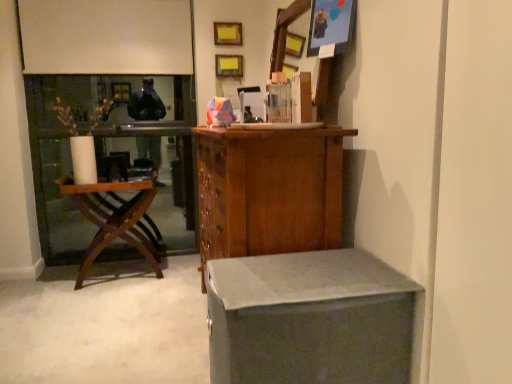
Question: Considering the relative positions of woodenchair at left and matte gray desk at lower right in the image provided, is woodenchair at left behind matte gray desk at lower right?

Choices:
 (A) yes
 (B) no

Answer: (A)

Question: Is woodenchair at left oriented towards matte gray desk at lower right?

Choices:
 (A) no
 (B) yes

Answer: (B)

Question: Is woodenchair at left beside matte gray desk at lower right?

Choices:
 (A) no
 (B) yes

Answer: (A)

Question: Is woodenchair at left positioned beyond the bounds of matte gray desk at lower right?

Choices:
 (A) no
 (B) yes

Answer: (B)

Question: Is woodenchair at left taller than matte gray desk at lower right?

Choices:
 (A) no
 (B) yes

Answer: (B)

Question: Can you confirm if woodenchair at left is wider than matte gray desk at lower right?

Choices:
 (A) yes
 (B) no

Answer: (B)

Question: Can you confirm if wooden picture frame at upper center, the 2th picture frame when ordered from left to right, is thinner than matte gray desk at lower right?

Choices:
 (A) no
 (B) yes

Answer: (B)

Question: Would you say wooden picture frame at upper center, acting as the 2th picture frame starting from the top, is outside matte gray desk at lower right?

Choices:
 (A) no
 (B) yes

Answer: (B)

Question: Can you confirm if wooden picture frame at upper center, which is the 3th picture frame in front-to-back order, is taller than matte gray desk at lower right?

Choices:
 (A) yes
 (B) no

Answer: (B)

Question: Can you confirm if wooden picture frame at upper center, which is the 3th picture frame in front-to-back order, is bigger than matte gray desk at lower right?

Choices:
 (A) no
 (B) yes

Answer: (A)

Question: Is wooden picture frame at upper center, acting as the 2th picture frame starting from the top, with matte gray desk at lower right?

Choices:
 (A) no
 (B) yes

Answer: (A)

Question: Considering the relative positions of wooden picture frame at upper center, acting as the 2th picture frame starting from the top, and matte gray desk at lower right in the image provided, is wooden picture frame at upper center, acting as the 2th picture frame starting from the top, to the right of matte gray desk at lower right from the viewer's perspective?

Choices:
 (A) no
 (B) yes

Answer: (A)

Question: Could you tell me if wooden cabinet at center is facing matte wooden picture frame at upper right, the third picture frame when ordered from back to front?

Choices:
 (A) yes
 (B) no

Answer: (B)